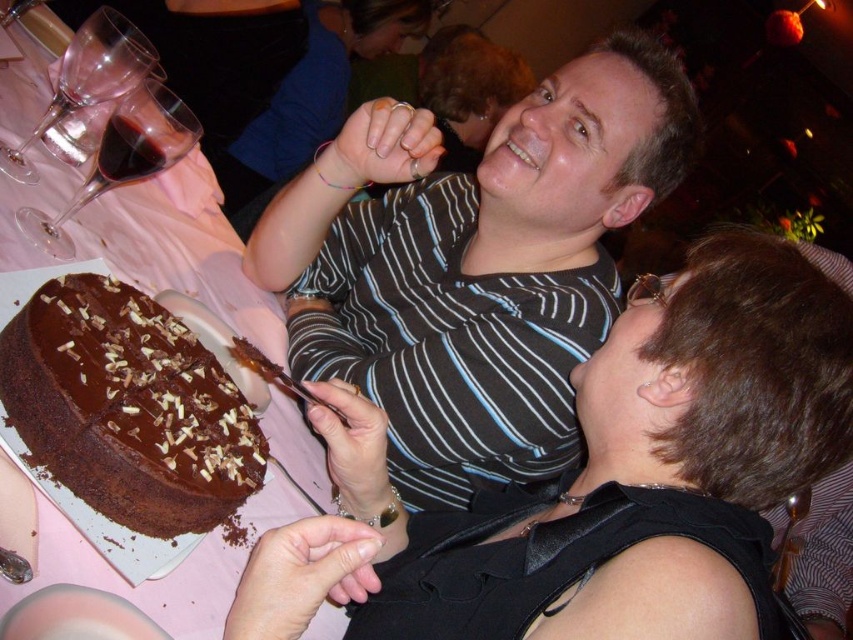
Between black fabric at center and striped shirt at upper center, which one appears on the right side from the viewer's perspective?

black fabric at center is more to the right.

Between point (492, 545) and point (589, 120), which one is positioned in front?

Point (492, 545) is more forward.

Locate an element on the screen. Image resolution: width=853 pixels, height=640 pixels. black fabric at center is located at coordinates (614, 477).

Is striped shirt at upper center closer to camera compared to chocolate cake at left?

No, striped shirt at upper center is behind chocolate cake at left.

Which is above, striped shirt at upper center or chocolate cake at left?

Positioned higher is chocolate cake at left.

The width and height of the screenshot is (853, 640). What do you see at coordinates (474, 262) in the screenshot? I see `striped shirt at upper center` at bounding box center [474, 262].

Locate an element on the screen. striped shirt at upper center is located at coordinates (474, 262).

Which is above, black fabric at center or chocolatesmoothcake at left?

chocolatesmoothcake at left

In the scene shown: Is black fabric at center wider than chocolatesmoothcake at left?

Indeed, black fabric at center has a greater width compared to chocolatesmoothcake at left.

The width and height of the screenshot is (853, 640). What are the coordinates of `black fabric at center` in the screenshot? It's located at (614, 477).